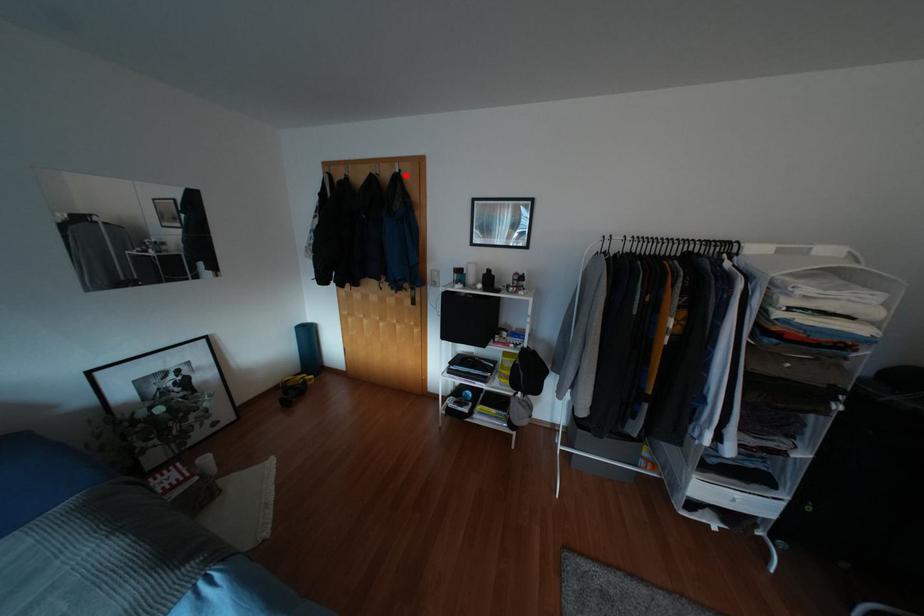
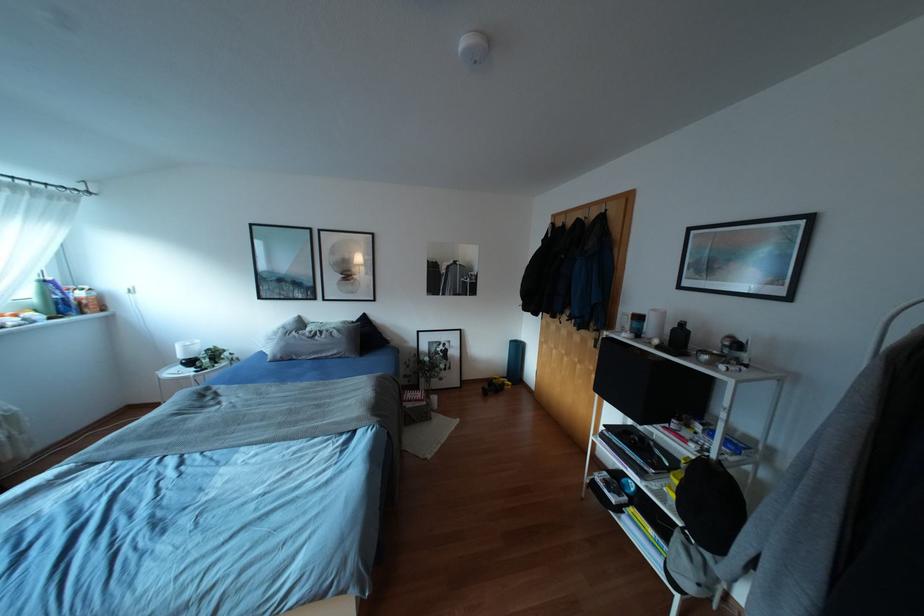
Find the pixel in the second image that matches the highlighted location in the first image.

(612, 214)